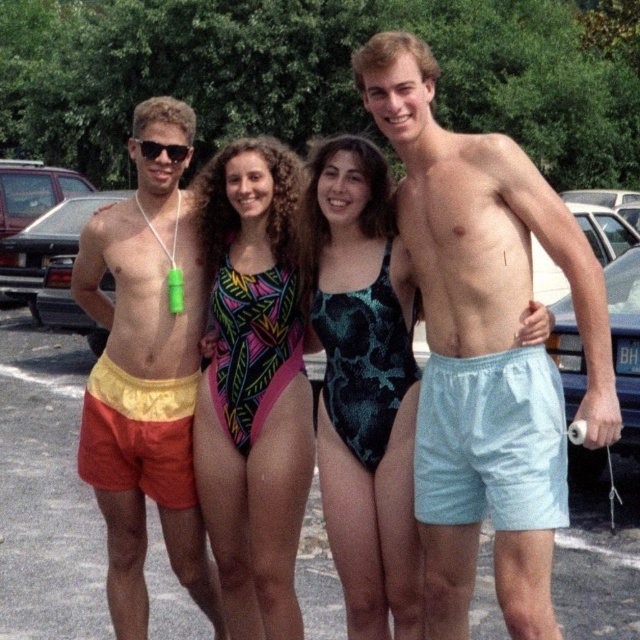
Is light blue fabric shorts at right shorter than matte yellow swim shorts at left?

Indeed, light blue fabric shorts at right has a lesser height compared to matte yellow swim shorts at left.

Consider the image. Can you confirm if light blue fabric shorts at right is positioned below matte yellow swim shorts at left?

Actually, light blue fabric shorts at right is above matte yellow swim shorts at left.

What do you see at coordinates (483, 339) in the screenshot? This screenshot has height=640, width=640. I see `light blue fabric shorts at right` at bounding box center [483, 339].

Where is `light blue fabric shorts at right`? Image resolution: width=640 pixels, height=640 pixels. light blue fabric shorts at right is located at coordinates (483, 339).

Can you confirm if light blue fabric shorts at right is thinner than black plastic sunglasses at left?

Incorrect, light blue fabric shorts at right's width is not less than black plastic sunglasses at left's.

Does light blue fabric shorts at right have a larger size compared to black plastic sunglasses at left?

Indeed, light blue fabric shorts at right has a larger size compared to black plastic sunglasses at left.

Which is in front, point (465, 628) or point (144, 156)?

Point (465, 628) is in front.

Where is `light blue fabric shorts at right`? light blue fabric shorts at right is located at coordinates (483, 339).

Can you confirm if matte yellow swim shorts at left is positioned to the right of black plastic sunglasses at left?

Incorrect, matte yellow swim shorts at left is not on the right side of black plastic sunglasses at left.

Does matte yellow swim shorts at left have a greater width compared to black plastic sunglasses at left?

Yes, matte yellow swim shorts at left is wider than black plastic sunglasses at left.

Between point (145, 547) and point (144, 157), which one is positioned in front?

Point (144, 157)

The width and height of the screenshot is (640, 640). Identify the location of matte yellow swim shorts at left. (147, 374).